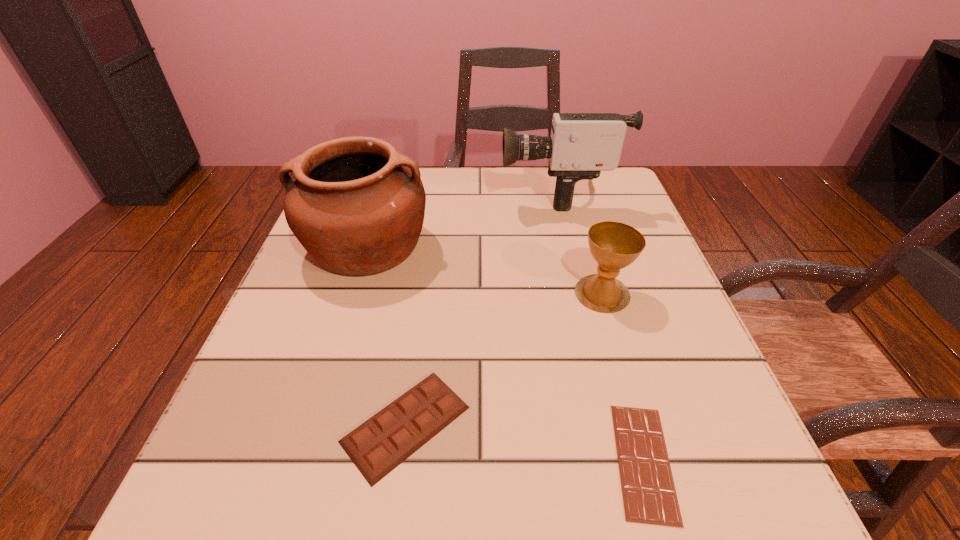
The height and width of the screenshot is (540, 960). Identify the location of camcorder. (581, 145).

Identify the location of pottery. (357, 206).

Find the location of a particular element. the third shortest object is located at coordinates (614, 245).

Identify the location of the taller chocolate bar. (376, 447).

Find the location of a particular element. The image size is (960, 540). the left chocolate bar is located at coordinates (376, 447).

This screenshot has width=960, height=540. I want to click on the right chocolate bar, so click(x=649, y=495).

The image size is (960, 540). Identify the location of the shortest object. click(x=649, y=495).

Locate an element on the screen. free point located on the recording direction of the camcorder is located at coordinates (450, 193).

You are a GUI agent. You are given a task and a screenshot of the screen. Output one action in this format:
    pyautogui.click(x=<x>, y=<y>)
    Task: Click on the free space located on the recording direction of the camcorder
    
    Given the screenshot: What is the action you would take?
    pyautogui.click(x=409, y=193)

Image resolution: width=960 pixels, height=540 pixels. Identify the location of vacant space located 0.370m on the recording direction of the camcorder. (348, 193).